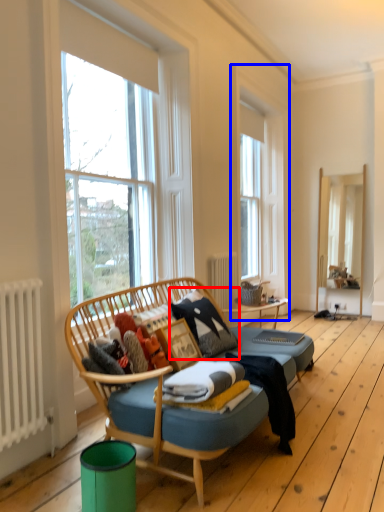
Question: Which object appears farthest to the camera in this image, pillow (highlighted by a red box) or window frame (highlighted by a blue box)?

Choices:
 (A) pillow
 (B) window frame

Answer: (B)